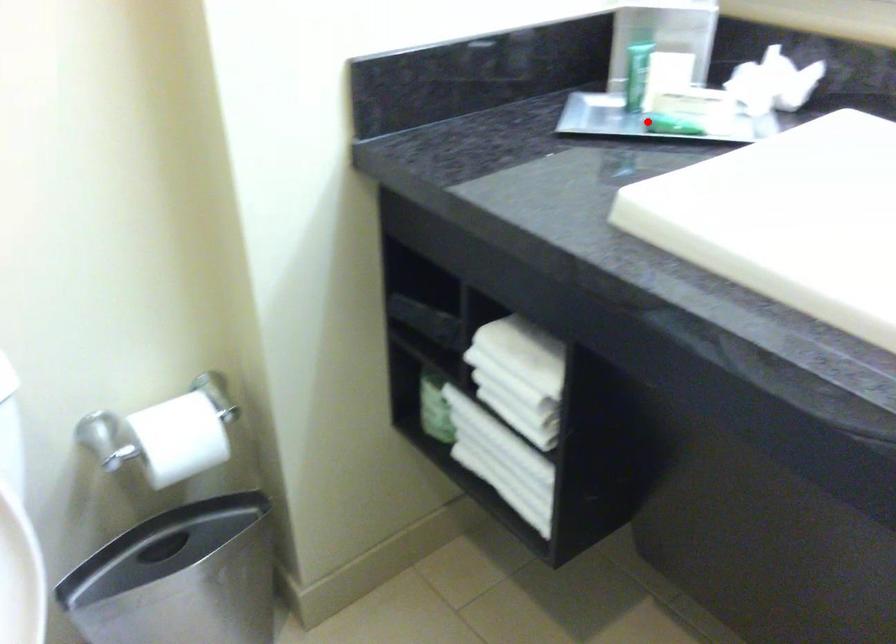
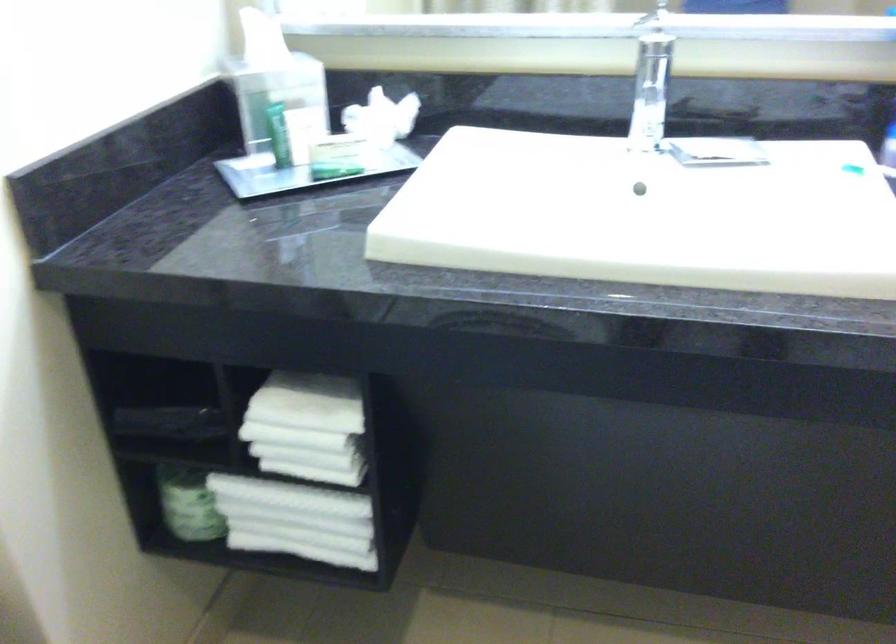
Question: A red point is marked in image1. In image2, is the corresponding 3D point closer to the camera or farther? Reply with the corresponding letter.

Choices:
 (A) The corresponding 3D point is closer.
 (B) The corresponding 3D point is farther.

Answer: (B)